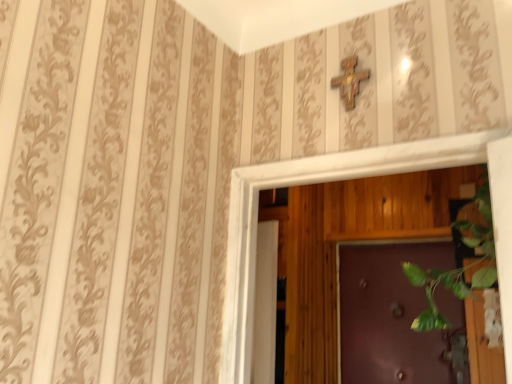
Question: In terms of height, does wooden cross at upper center look taller or shorter compared to purple glossy door at center?

Choices:
 (A) tall
 (B) short

Answer: (B)

Question: Looking at their shapes, would you say wooden cross at upper center is wider or thinner than purple glossy door at center?

Choices:
 (A) thin
 (B) wide

Answer: (A)

Question: From the image's perspective, is wooden cross at upper center located above or below purple glossy door at center?

Choices:
 (A) below
 (B) above

Answer: (B)

Question: Is purple glossy door at center taller or shorter than wooden cross at upper center?

Choices:
 (A) tall
 (B) short

Answer: (A)

Question: Looking at the image, does purple glossy door at center seem bigger or smaller compared to wooden cross at upper center?

Choices:
 (A) big
 (B) small

Answer: (A)

Question: Based on their positions, is purple glossy door at center located to the left or right of wooden cross at upper center?

Choices:
 (A) right
 (B) left

Answer: (A)

Question: Relative to wooden cross at upper center, is purple glossy door at center in front or behind?

Choices:
 (A) behind
 (B) front

Answer: (A)